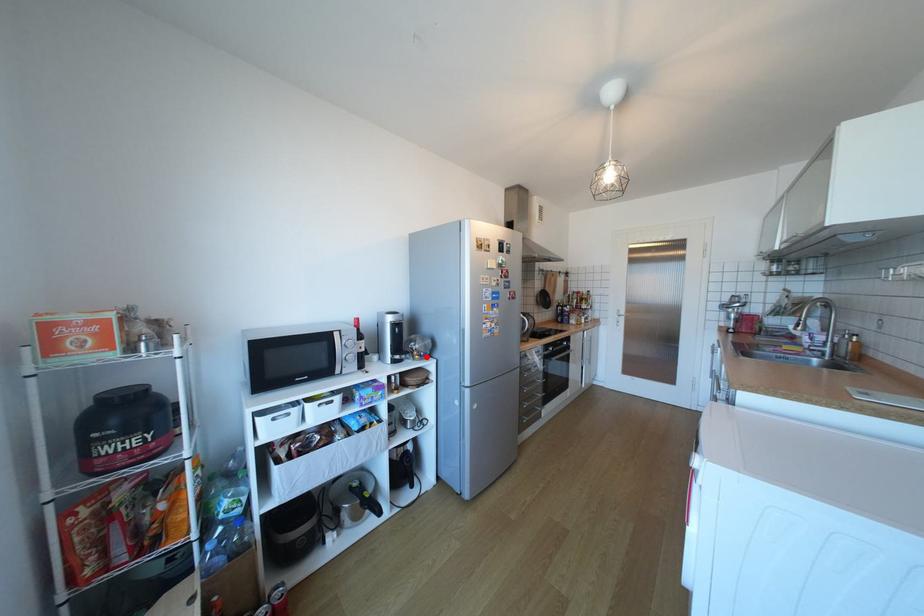
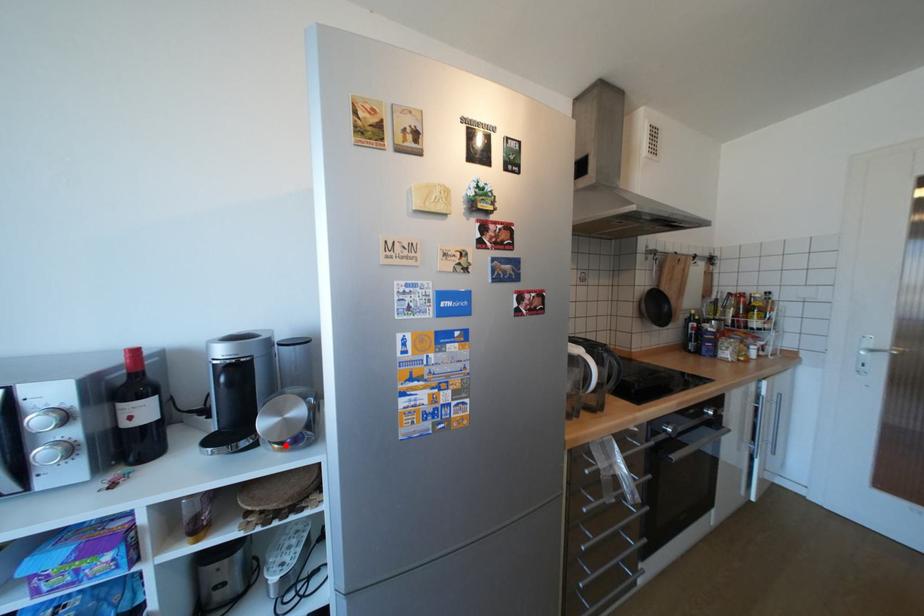
I am providing you with two images of the same scene from different viewpoints. A red point is marked on the first image and another point is marked on the second image. Is the marked point in image1 the same physical position as the marked point in image2?

Yes